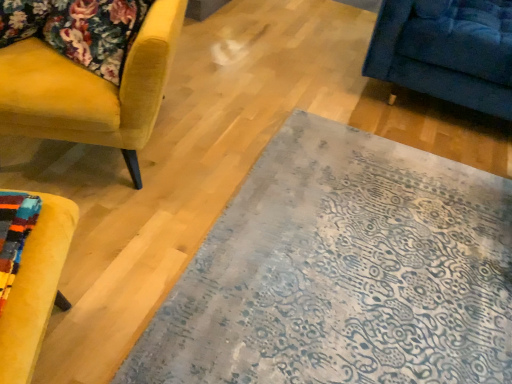
Question: Considering the relative sizes of velvet yellow armchair at left and velvet floral cushion at upper left in the image provided, is velvet yellow armchair at left shorter than velvet floral cushion at upper left?

Choices:
 (A) yes
 (B) no

Answer: (B)

Question: From a real-world perspective, is velvet yellow armchair at left below velvet floral cushion at upper left?

Choices:
 (A) no
 (B) yes

Answer: (B)

Question: Does velvet yellow armchair at left have a smaller size compared to velvet floral cushion at upper left?

Choices:
 (A) no
 (B) yes

Answer: (A)

Question: Is velvet yellow armchair at left to the right of velvet floral cushion at upper left from the viewer's perspective?

Choices:
 (A) yes
 (B) no

Answer: (B)

Question: Can velvet floral cushion at upper left be found inside velvet yellow armchair at left?

Choices:
 (A) no
 (B) yes

Answer: (B)

Question: Is velvet yellow armchair at left not within velvet floral cushion at upper left?

Choices:
 (A) yes
 (B) no

Answer: (A)

Question: Would you say blue-patterned rug at center is outside velvet yellow armchair at left?

Choices:
 (A) yes
 (B) no

Answer: (A)

Question: Is blue-patterned rug at center smaller than velvet yellow armchair at left?

Choices:
 (A) yes
 (B) no

Answer: (A)

Question: Does blue-patterned rug at center appear on the right side of velvet yellow armchair at left?

Choices:
 (A) yes
 (B) no

Answer: (A)

Question: Does blue-patterned rug at center have a greater width compared to velvet yellow armchair at left?

Choices:
 (A) yes
 (B) no

Answer: (A)

Question: Does blue-patterned rug at center come in front of velvet yellow armchair at left?

Choices:
 (A) yes
 (B) no

Answer: (A)

Question: Is blue-patterned rug at center aimed at velvet yellow armchair at left?

Choices:
 (A) no
 (B) yes

Answer: (A)

Question: Is velvet yellow armchair at left completely or partially outside of blue-patterned rug at center?

Choices:
 (A) yes
 (B) no

Answer: (A)